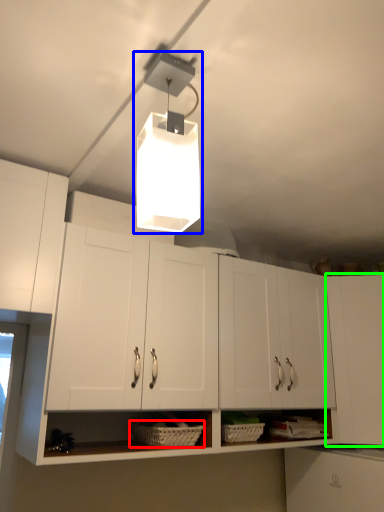
Question: Based on their relative distances, which object is nearer to basket (highlighted by a red box)? Choose from lamp (highlighted by a blue box) and cabinetry (highlighted by a green box).

Choices:
 (A) lamp
 (B) cabinetry

Answer: (B)